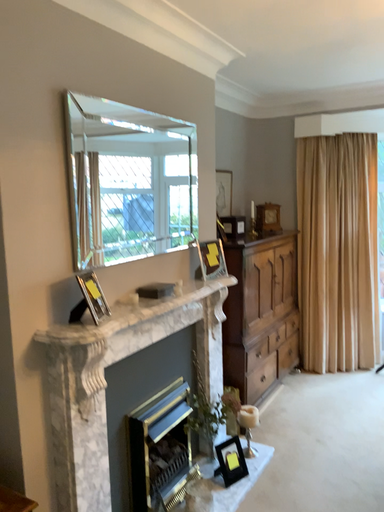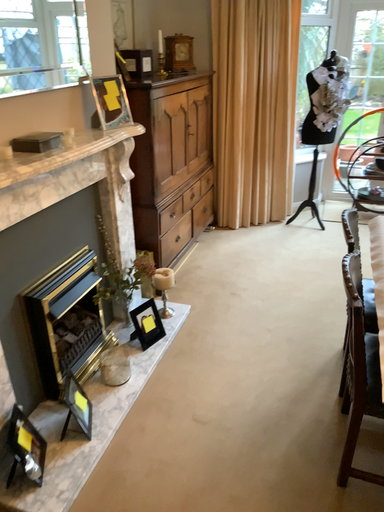
Question: How did the camera likely rotate when shooting the video?

Choices:
 (A) rotated downward
 (B) rotated upward

Answer: (A)